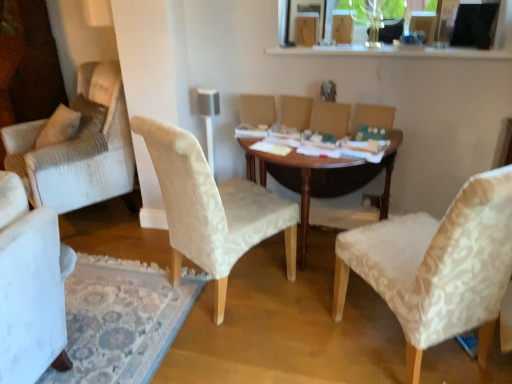
Question: Is white textured chair at center, which is the 2th chair from right to left, at the back of wooden table at center?

Choices:
 (A) yes
 (B) no

Answer: (B)

Question: Would you consider wooden table at center to be distant from white textured chair at center, which is the 2th chair from right to left?

Choices:
 (A) yes
 (B) no

Answer: (B)

Question: Would you say white textured chair at center, which is counted as the first chair, starting from the left, is part of wooden table at center's contents?

Choices:
 (A) no
 (B) yes

Answer: (A)

Question: Considering the relative positions of wooden table at center and white textured chair at center, which is the 2th chair from right to left, in the image provided, is wooden table at center to the left of white textured chair at center, which is the 2th chair from right to left, from the viewer's perspective?

Choices:
 (A) yes
 (B) no

Answer: (B)

Question: Does wooden table at center have a lesser width compared to white textured chair at center, which is the 2th chair from right to left?

Choices:
 (A) no
 (B) yes

Answer: (A)

Question: In the image, is white textured chair at center, which is counted as the first chair, starting from the left, positioned in front of or behind beige fabric armchair at center, which is counted as the second armchair, starting from the left?

Choices:
 (A) front
 (B) behind

Answer: (A)

Question: From a real-world perspective, relative to beige fabric armchair at center, which is counted as the second armchair, starting from the left, is white textured chair at center, which is the 2th chair from right to left, vertically above or below?

Choices:
 (A) above
 (B) below

Answer: (B)

Question: Do you think white textured chair at center, which is counted as the first chair, starting from the left, is within beige fabric armchair at center, marked as the 1th armchair in a right-to-left arrangement, or outside of it?

Choices:
 (A) inside
 (B) outside

Answer: (B)

Question: Would you say white textured chair at center, which is counted as the first chair, starting from the left, is to the left or to the right of beige fabric armchair at center, which is counted as the second armchair, starting from the left, in the picture?

Choices:
 (A) right
 (B) left

Answer: (B)

Question: Considering their positions, is wooden table at center located in front of or behind white textured chair at center, which is counted as the first chair, starting from the left?

Choices:
 (A) front
 (B) behind

Answer: (B)

Question: Considering the positions of wooden table at center and white textured chair at center, which is counted as the first chair, starting from the left, in the image, is wooden table at center taller or shorter than white textured chair at center, which is counted as the first chair, starting from the left,?

Choices:
 (A) short
 (B) tall

Answer: (A)

Question: Is point (318, 173) closer or farther from the camera than point (240, 185)?

Choices:
 (A) closer
 (B) farther

Answer: (B)

Question: From a real-world perspective, is wooden table at center positioned above or below white textured chair at center, which is the 2th chair from right to left?

Choices:
 (A) below
 (B) above

Answer: (A)

Question: From the image's perspective, is wooden table at center located above or below velvet beige armchair at center, positioned as the first armchair in left-to-right order?

Choices:
 (A) above
 (B) below

Answer: (B)

Question: Relative to velvet beige armchair at center, which is the second armchair in right-to-left order, is wooden table at center in front or behind?

Choices:
 (A) front
 (B) behind

Answer: (A)